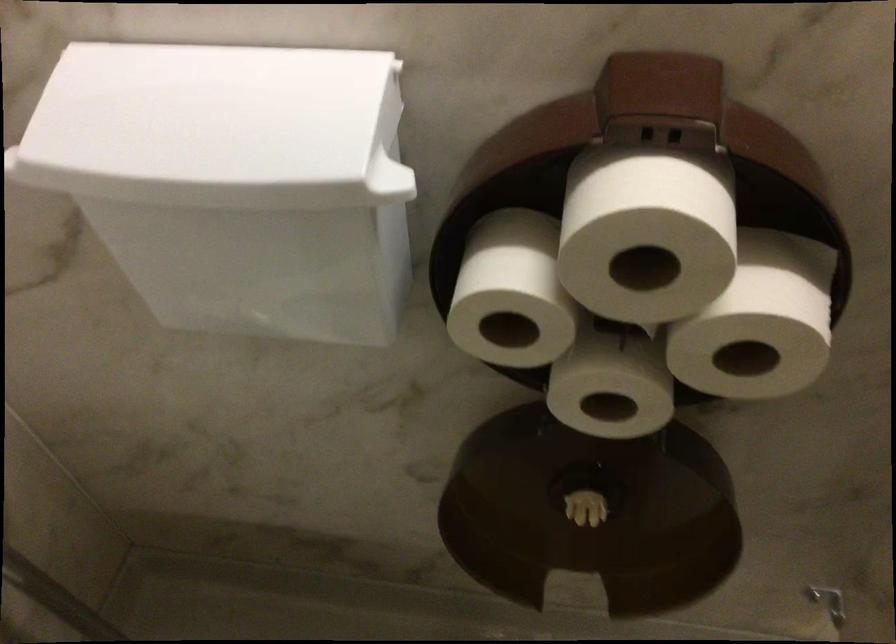
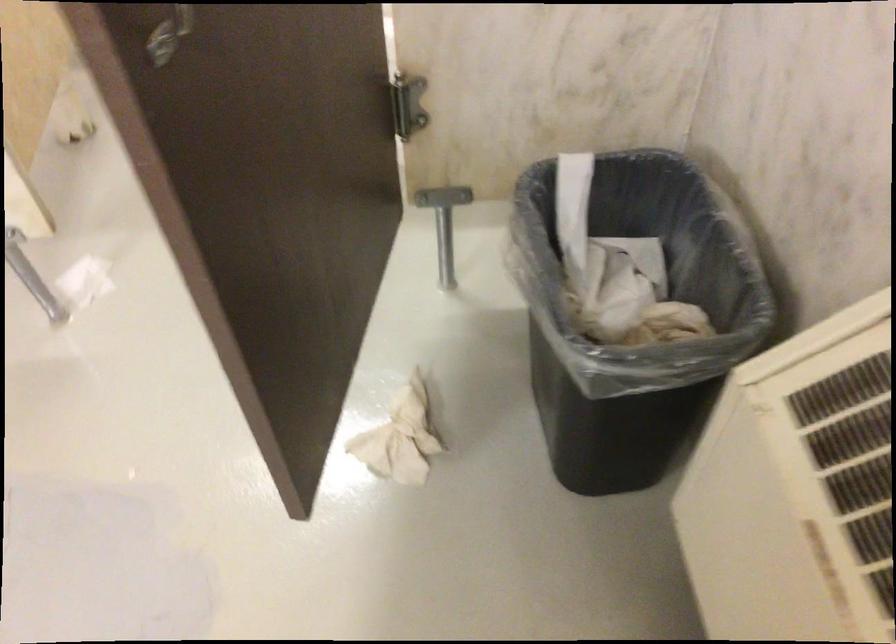
Which direction would the cameraman need to move to produce the second image?

The cameraman moved toward right, backward.